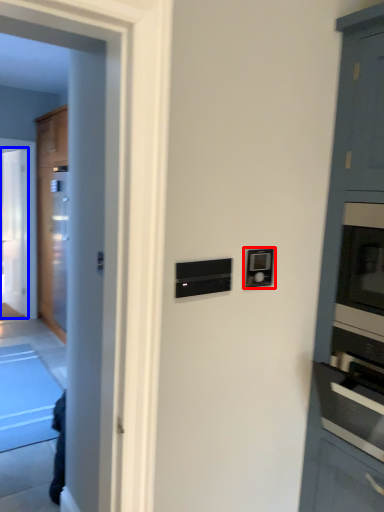
Question: Which object is closer to the camera taking this photo, light switch (highlighted by a red box) or glass door (highlighted by a blue box)?

Choices:
 (A) light switch
 (B) glass door

Answer: (A)